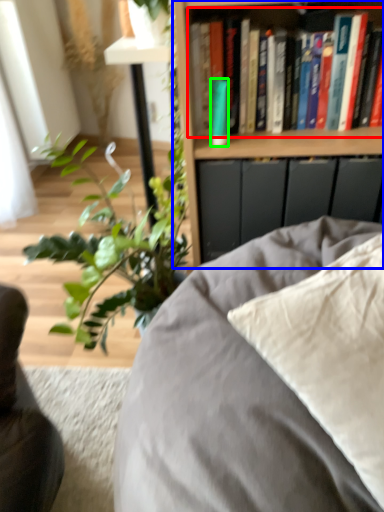
Question: Which object is positioned farthest from book (highlighted by a red box)? Select from bookcase (highlighted by a blue box) and paperback book (highlighted by a green box).

Choices:
 (A) bookcase
 (B) paperback book

Answer: (B)